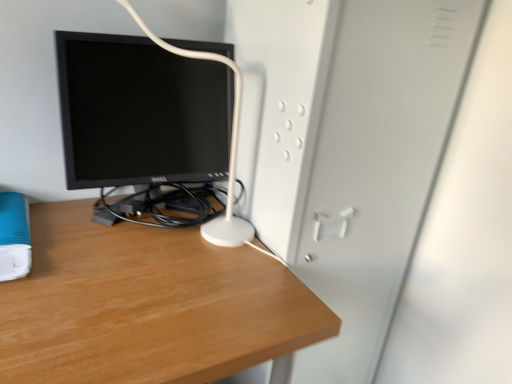
What are the coordinates of `unoccupied area in front of black glossy monitor at center` in the screenshot? It's located at (131, 300).